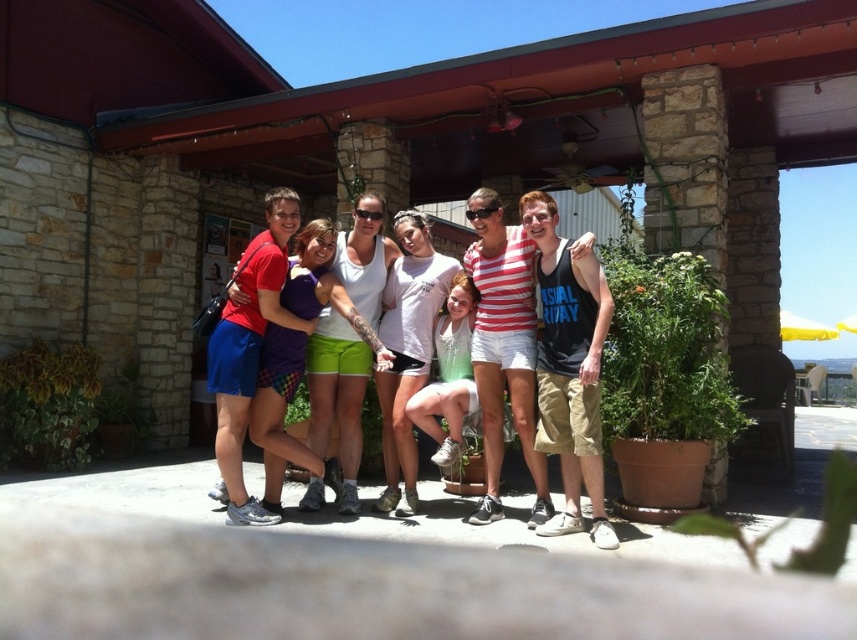
You are standing in front of the group photo and want to know if the white cotton shirt at center is visible in front of the plaid shorts at center. Based on the scene description, can you determine this?

The white cotton shirt at center is behind the plaid shorts at center, so it is not visible in front of the plaid shorts at center.